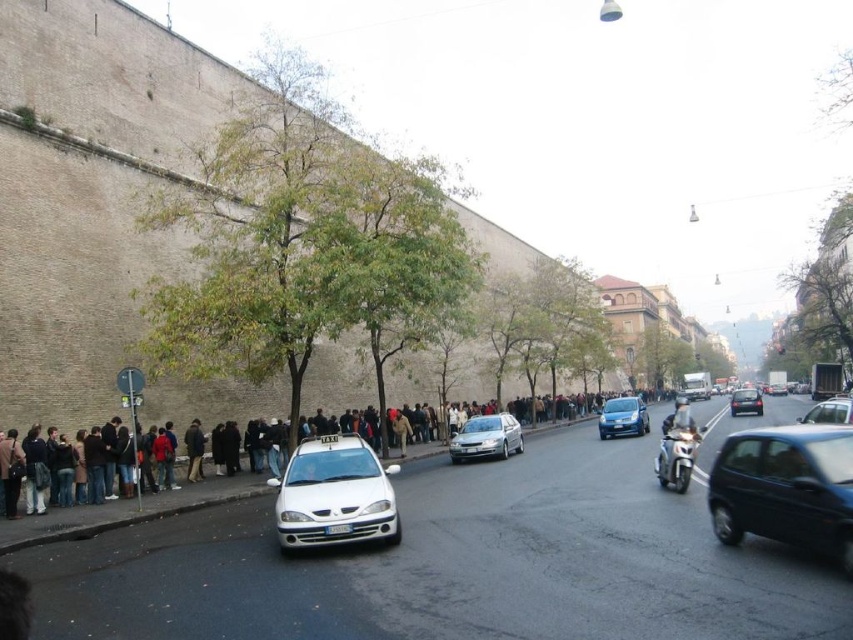
Question: Does satin silver sedan at center appear on the right side of shiny blue sedan at center?

Choices:
 (A) yes
 (B) no

Answer: (B)

Question: Which is nearer to the shiny blue sedan at center?

Choices:
 (A) dark gray fabric crowd at left
 (B) white matte taxi at center
 (C) shiny black car at center
 (D) satin silver sedan at center

Answer: (D)

Question: Which point is closer to the camera?

Choices:
 (A) satin silver sedan at center
 (B) shiny black sedan at center
 (C) white matte taxi at center
 (D) dark gray fabric crowd at left

Answer: (C)

Question: Which of the following is the closest to the observer?

Choices:
 (A) dark gray fabric crowd at left
 (B) metallic silver sedan at right
 (C) shiny blue sedan at center
 (D) white matte taxi at center

Answer: (D)

Question: Does dark gray fabric crowd at left appear on the left side of metallic silver sedan at right?

Choices:
 (A) yes
 (B) no

Answer: (A)

Question: Can you confirm if shiny black car at center is positioned to the left of satin silver sedan at center?

Choices:
 (A) no
 (B) yes

Answer: (A)